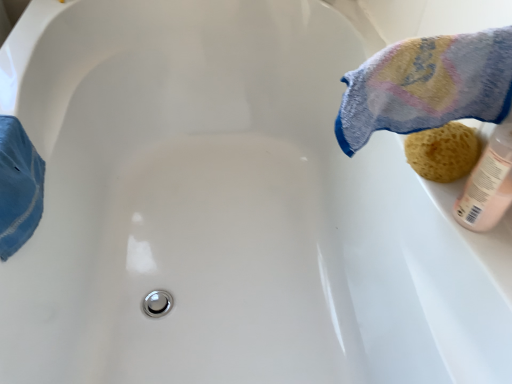
Question: From a real-world perspective, is yellow sponge at right positioned under multicolored terry cloth towel at upper right based on gravity?

Choices:
 (A) no
 (B) yes

Answer: (B)

Question: From a real-world perspective, is yellow sponge at right over multicolored terry cloth towel at upper right?

Choices:
 (A) no
 (B) yes

Answer: (A)

Question: Considering the relative sizes of yellow sponge at right and multicolored terry cloth towel at upper right in the image provided, is yellow sponge at right wider than multicolored terry cloth towel at upper right?

Choices:
 (A) no
 (B) yes

Answer: (A)

Question: Is yellow sponge at right further to the viewer compared to multicolored terry cloth towel at upper right?

Choices:
 (A) no
 (B) yes

Answer: (B)

Question: Can you confirm if yellow sponge at right is shorter than multicolored terry cloth towel at upper right?

Choices:
 (A) yes
 (B) no

Answer: (A)

Question: From the image's perspective, would you say yellow sponge at right is shown under multicolored terry cloth towel at upper right?

Choices:
 (A) yes
 (B) no

Answer: (A)

Question: From the image's perspective, is multicolored terry cloth towel at upper right located beneath yellow sponge at right?

Choices:
 (A) yes
 (B) no

Answer: (B)

Question: Would you say multicolored terry cloth towel at upper right is outside yellow sponge at right?

Choices:
 (A) yes
 (B) no

Answer: (A)

Question: Would you say yellow sponge at right is part of multicolored terry cloth towel at upper right's contents?

Choices:
 (A) no
 (B) yes

Answer: (A)

Question: From a real-world perspective, does multicolored terry cloth towel at upper right stand above yellow sponge at right?

Choices:
 (A) no
 (B) yes

Answer: (B)

Question: Can you confirm if multicolored terry cloth towel at upper right is thinner than yellow sponge at right?

Choices:
 (A) no
 (B) yes

Answer: (A)

Question: Does multicolored terry cloth towel at upper right have a lesser height compared to yellow sponge at right?

Choices:
 (A) yes
 (B) no

Answer: (B)

Question: Looking at their shapes, would you say yellow sponge at right is wider or thinner than multicolored terry cloth towel at upper right?

Choices:
 (A) wide
 (B) thin

Answer: (B)